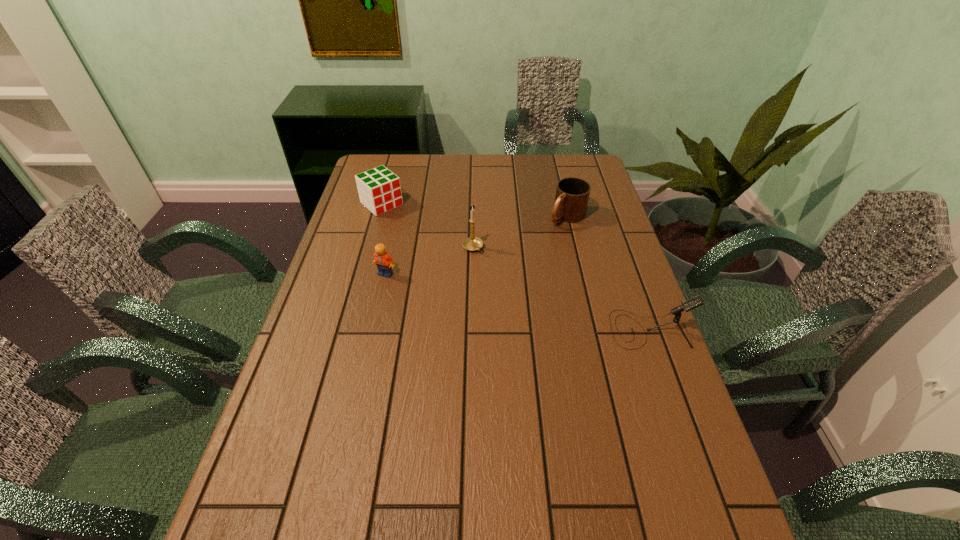
This screenshot has width=960, height=540. In order to click on blank region between the third farthest object and the microphone in this screenshot , I will do `click(561, 288)`.

Locate an element on the screen. The width and height of the screenshot is (960, 540). vacant area that lies between the second nearest object and the nearest object is located at coordinates (517, 301).

Find the location of a particular element. Image resolution: width=960 pixels, height=540 pixels. free space between the candle holder and the nearest object is located at coordinates (561, 288).

Find the location of a particular element. vacant point located between the Lego and the microphone is located at coordinates (517, 301).

I want to click on free space between the cube and the candle holder, so click(x=427, y=226).

Locate an element on the screen. This screenshot has width=960, height=540. vacant area that lies between the microphone and the third nearest object is located at coordinates (561, 288).

Image resolution: width=960 pixels, height=540 pixels. Identify the location of empty space that is in between the nearest object and the mug. (608, 273).

Locate which object is the second closest to the fourth farthest object. Please provide its 2D coordinates. Your answer should be formatted as a tuple, i.e. [(x, y)], where the tuple contains the x and y coordinates of a point satisfying the conditions above.

[(379, 189)]

Find the location of a particular element. The width and height of the screenshot is (960, 540). the second closest object to the third object from left to right is located at coordinates (572, 194).

At what (x,y) coordinates should I click in order to perform the action: click on vacant region that satisfies the following two spatial constraints: 1. on the front side of the cube; 2. on the stand of the nearest object. Please return your answer as a coordinate pair (x, y). This screenshot has height=540, width=960. Looking at the image, I should click on (347, 329).